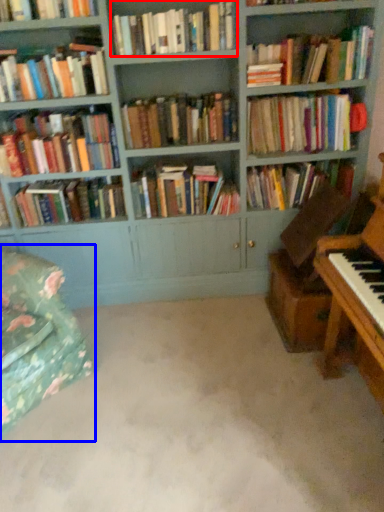
Question: Which object appears farthest to the camera in this image, book (highlighted by a red box) or swivel chair (highlighted by a blue box)?

Choices:
 (A) book
 (B) swivel chair

Answer: (A)